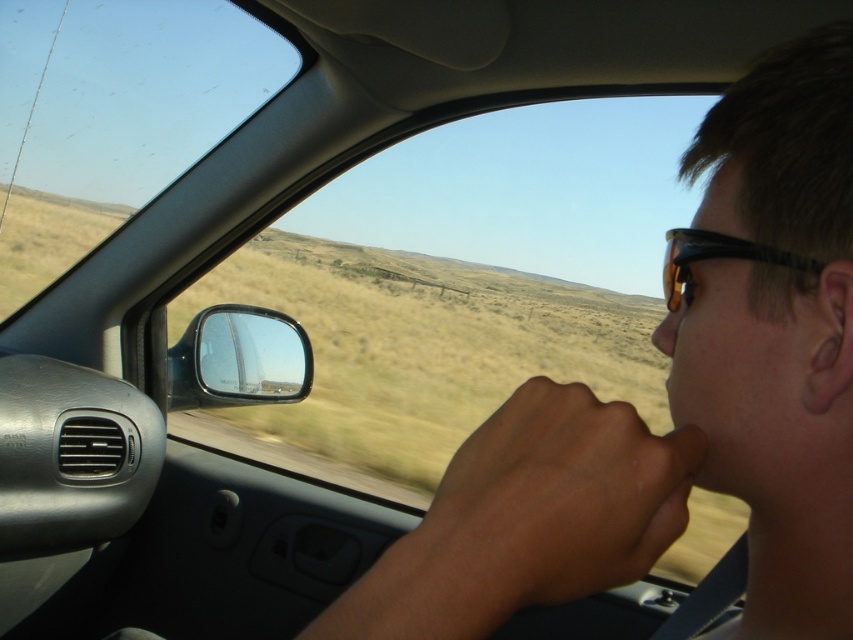
Is point (521, 556) in front of point (213, 392)?

Yes.

Locate an element on the screen. The width and height of the screenshot is (853, 640). light skin tone flesh at center is located at coordinates (550, 502).

Where is `light skin tone flesh at center`? This screenshot has width=853, height=640. light skin tone flesh at center is located at coordinates (550, 502).

Is glossy plastic side mirror at lower left bigger than matte orange nose at center?

Correct, glossy plastic side mirror at lower left is larger in size than matte orange nose at center.

This screenshot has width=853, height=640. In order to click on glossy plastic side mirror at lower left in this screenshot , I will do `click(239, 358)`.

Looking at this image, can you confirm if light skin tone flesh at center is positioned to the left of tortoiseshell plastic goggles at right?

Correct, you'll find light skin tone flesh at center to the left of tortoiseshell plastic goggles at right.

Looking at this image, how distant is light skin tone flesh at center from tortoiseshell plastic goggles at right?

A distance of 6.77 inches exists between light skin tone flesh at center and tortoiseshell plastic goggles at right.

What do you see at coordinates (550, 502) in the screenshot?
I see `light skin tone flesh at center` at bounding box center [550, 502].

Locate an element on the screen. This screenshot has height=640, width=853. light skin tone flesh at center is located at coordinates (550, 502).